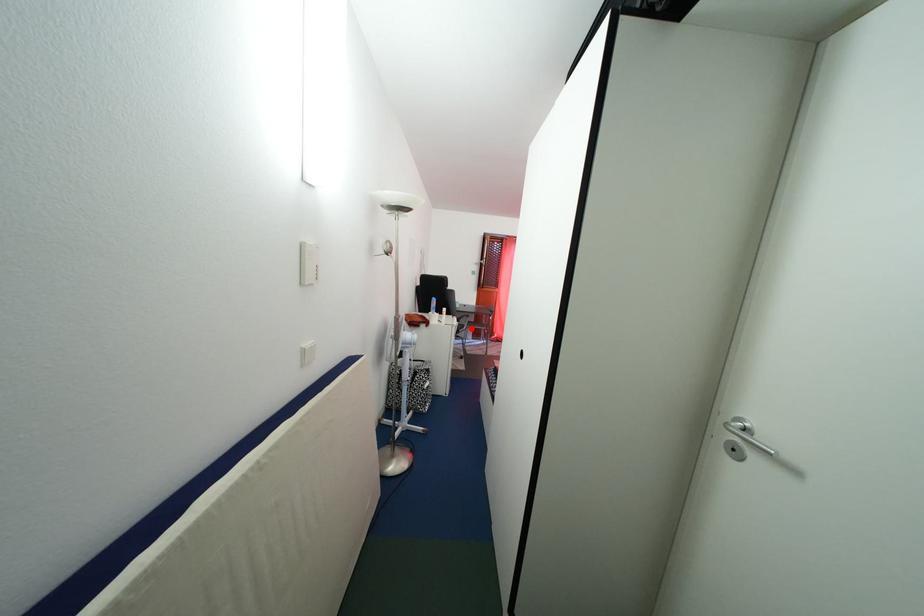
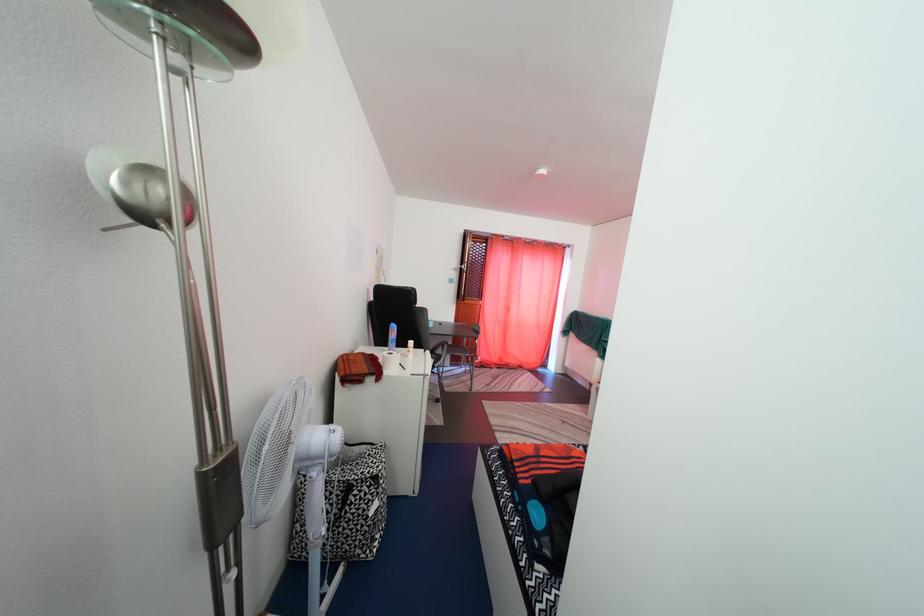
Find the pixel in the second image that matches the highlighted location in the first image.

(447, 359)